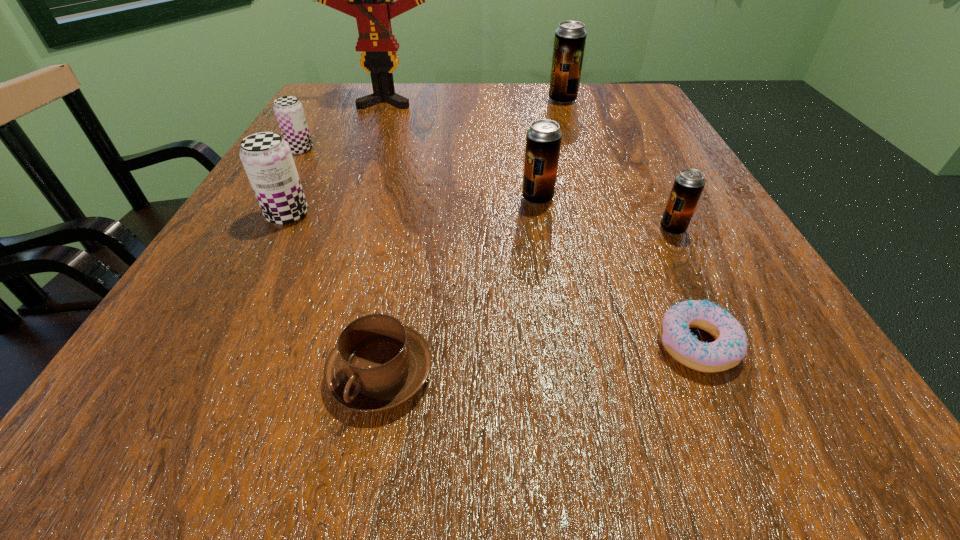
This screenshot has width=960, height=540. I want to click on free space that satisfies the following two spatial constraints: 1. on the front side of the nearer purple beer can; 2. on the right side of the rightmost black beer can, so click(280, 229).

In order to click on free point that satisfies the following two spatial constraints: 1. on the front side of the nearer purple beer can; 2. on the right side of the doughnut in this screenshot , I will do `click(220, 345)`.

Where is `vacant point that satisfies the following two spatial constraints: 1. on the front-facing side of the second nearest black beer can; 2. on the left side of the nutcracker`? This screenshot has height=540, width=960. vacant point that satisfies the following two spatial constraints: 1. on the front-facing side of the second nearest black beer can; 2. on the left side of the nutcracker is located at coordinates (349, 198).